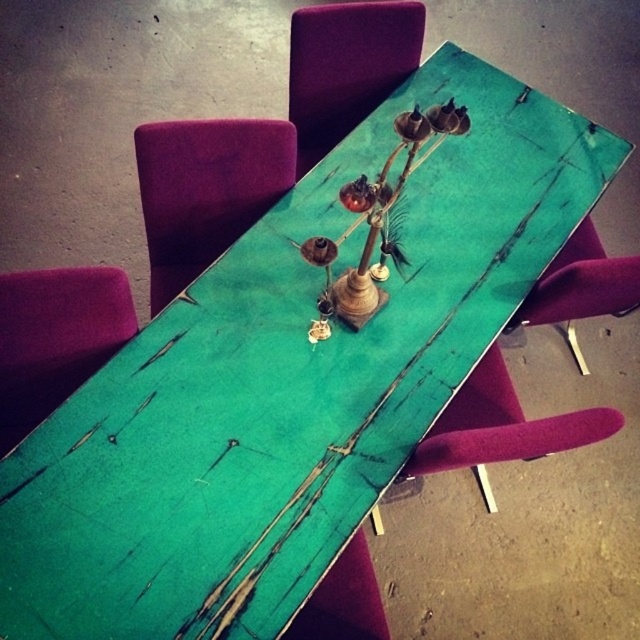
Question: Is the position of purple fabric chair at center less distant than that of velvet magenta chair at lower right?

Choices:
 (A) no
 (B) yes

Answer: (A)

Question: Is matte purple chair at upper center smaller than velvet magenta chair at lower right?

Choices:
 (A) yes
 (B) no

Answer: (A)

Question: Which is nearer to the matte purple chair at upper center?

Choices:
 (A) teal wood chair at center
 (B) velvet magenta chair at lower right
 (C) purple fabric chair at center
 (D) purple fabric chair at left

Answer: (C)

Question: Which point appears farthest from the camera in this image?

Choices:
 (A) (88, 298)
 (B) (376, 70)
 (C) (476, 456)
 (D) (634, 257)

Answer: (B)

Question: Can you confirm if purple fabric chair at center is bigger than purple fabric chair at left?

Choices:
 (A) no
 (B) yes

Answer: (B)

Question: Which point appears farthest from the camera in this image?

Choices:
 (A) (204, 236)
 (B) (476, 365)
 (C) (115, 332)

Answer: (A)